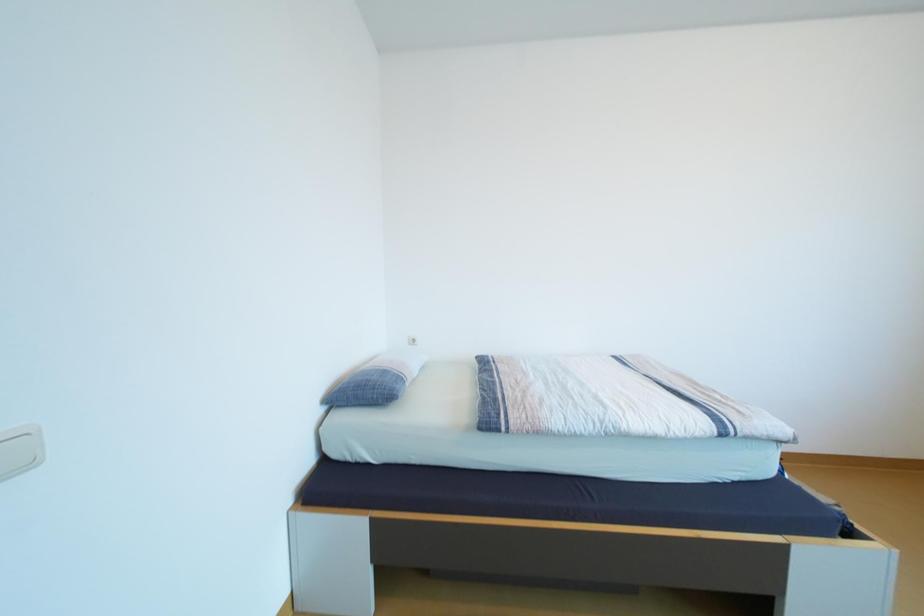
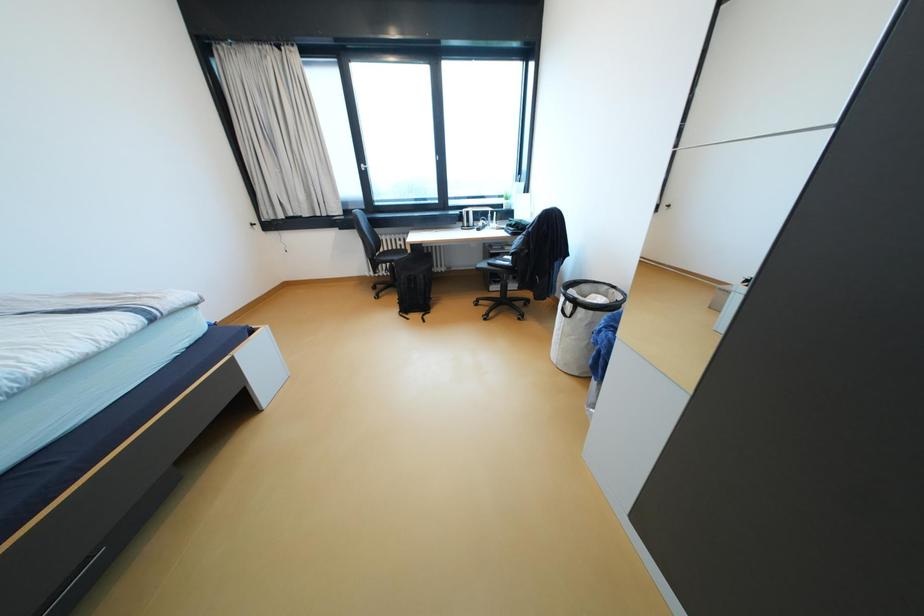
First-person continuous shooting, in which direction is the camera rotating?

The camera rotated toward right-down.